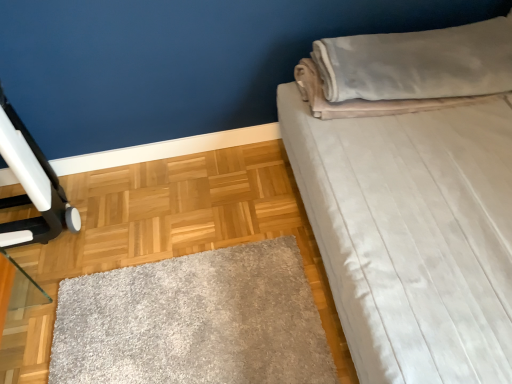
Question: In terms of width, does velvet beige pillow at upper right look wider or thinner when compared to white soft bed at upper right?

Choices:
 (A) wide
 (B) thin

Answer: (B)

Question: Would you say velvet beige pillow at upper right is to the left or to the right of white soft bed at upper right in the picture?

Choices:
 (A) right
 (B) left

Answer: (B)

Question: In terms of height, does velvet beige pillow at upper right look taller or shorter compared to white soft bed at upper right?

Choices:
 (A) tall
 (B) short

Answer: (B)

Question: Considering the positions of white soft bed at upper right and velvet beige pillow at upper right in the image, is white soft bed at upper right taller or shorter than velvet beige pillow at upper right?

Choices:
 (A) short
 (B) tall

Answer: (B)

Question: From a real-world perspective, is white soft bed at upper right positioned above or below velvet beige pillow at upper right?

Choices:
 (A) below
 (B) above

Answer: (B)

Question: Considering the positions of white soft bed at upper right and velvet beige pillow at upper right in the image, is white soft bed at upper right wider or thinner than velvet beige pillow at upper right?

Choices:
 (A) thin
 (B) wide

Answer: (B)

Question: In the image, is white soft bed at upper right on the left side or the right side of velvet beige pillow at upper right?

Choices:
 (A) left
 (B) right

Answer: (B)